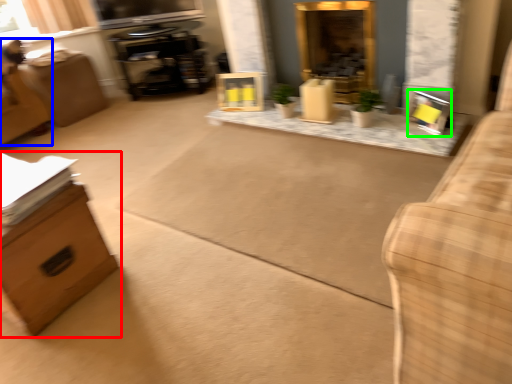
Question: Considering the real-world distances, which object is closest to furniture (highlighted by a red box)? swivel chair (highlighted by a blue box) or picture frame (highlighted by a green box).

Choices:
 (A) swivel chair
 (B) picture frame

Answer: (A)